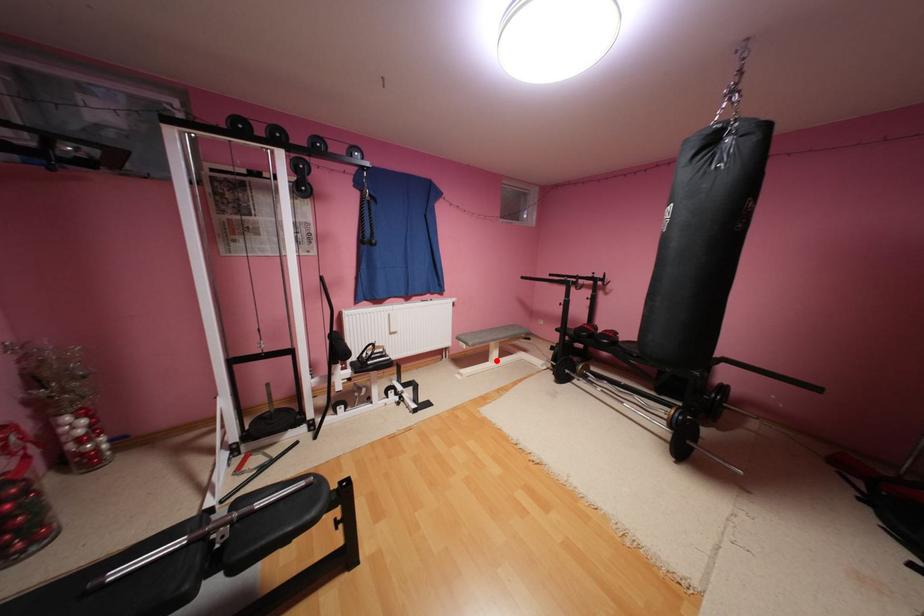
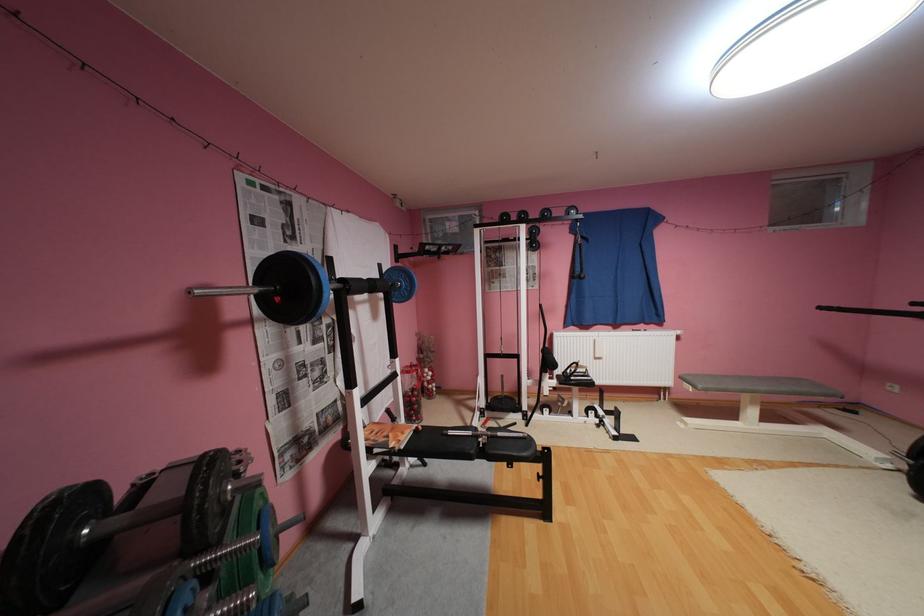
In the second image, find the point that corresponds to the highlighted location in the first image.

(746, 419)